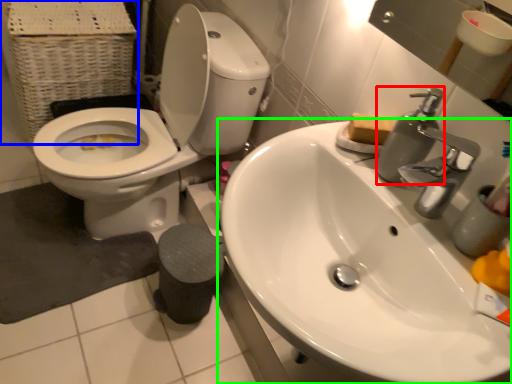
Question: Considering the real-world distances, which object is farthest from soap dispenser (highlighted by a red box)? basket (highlighted by a blue box) or sink (highlighted by a green box)?

Choices:
 (A) basket
 (B) sink

Answer: (A)